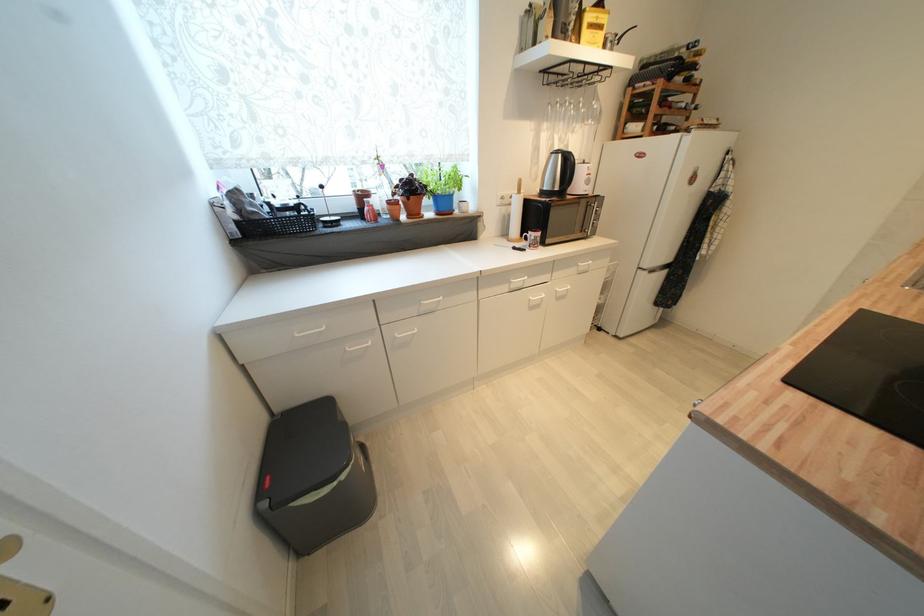
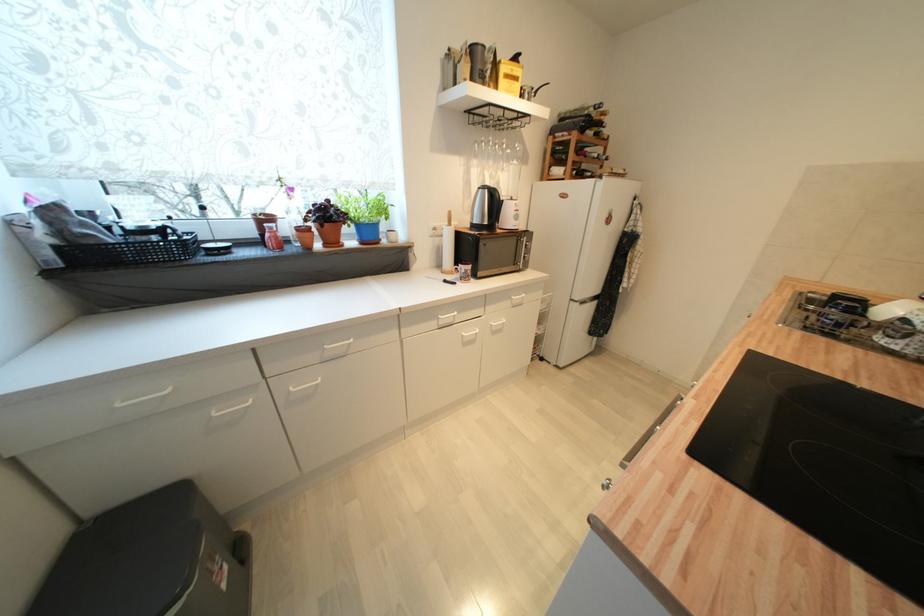
Find the pixel in the second image that matches point (395, 199) in the first image.

(306, 225)